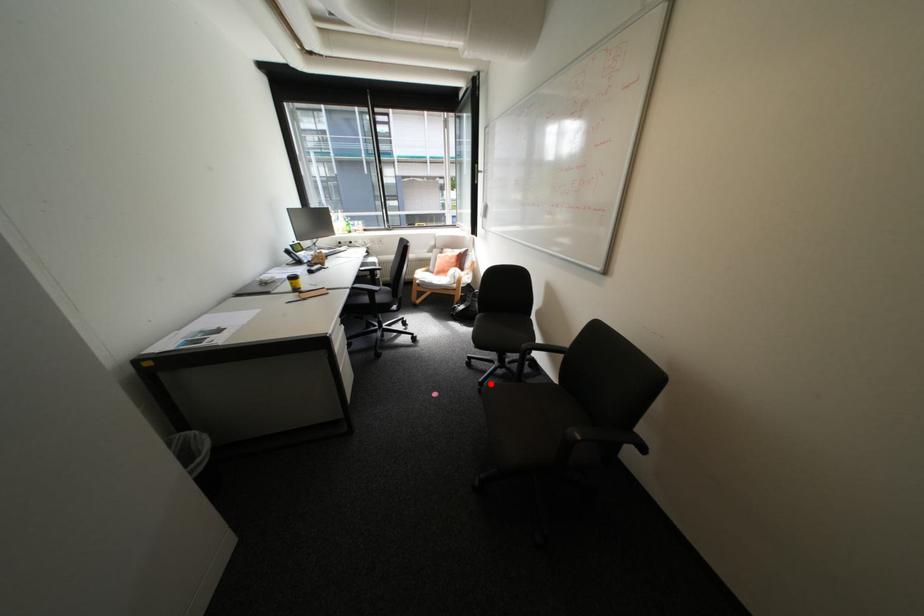
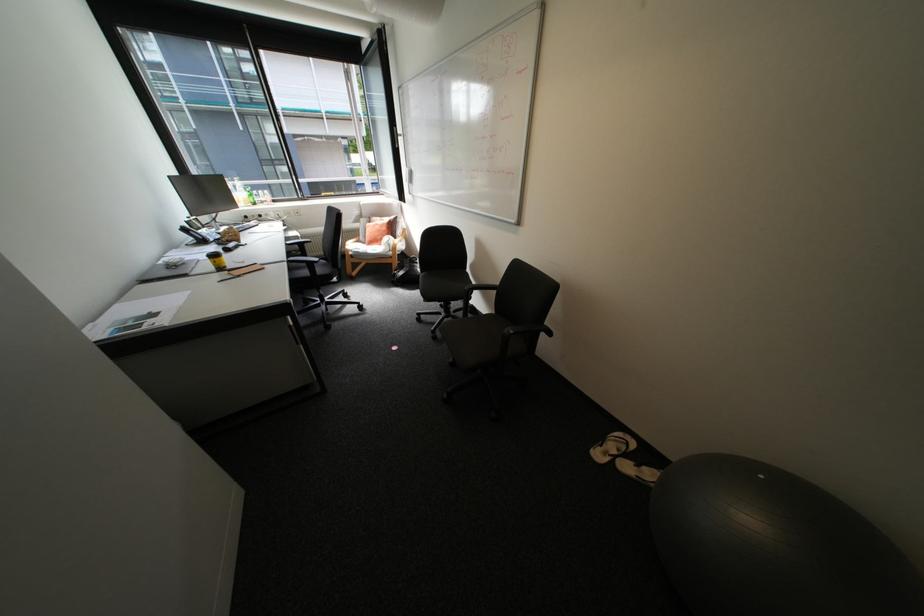
Question: I am providing you with two images of the same scene from different viewpoints. In image1, a red point is highlighted. Considering the same 3D point in image2, which of the following is correct?

Choices:
 (A) It is closer
 (B) It is farther

Answer: (B)